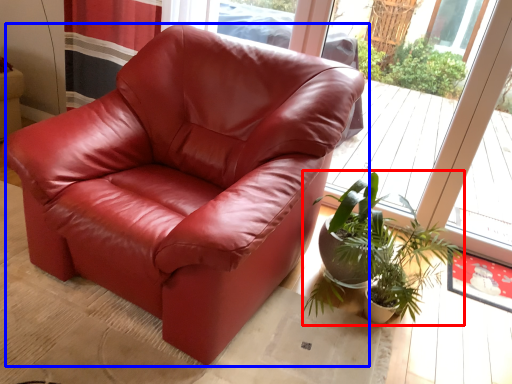
Question: Which object appears closest to the camera in this image, houseplant (highlighted by a red box) or chair (highlighted by a blue box)?

Choices:
 (A) houseplant
 (B) chair

Answer: (B)